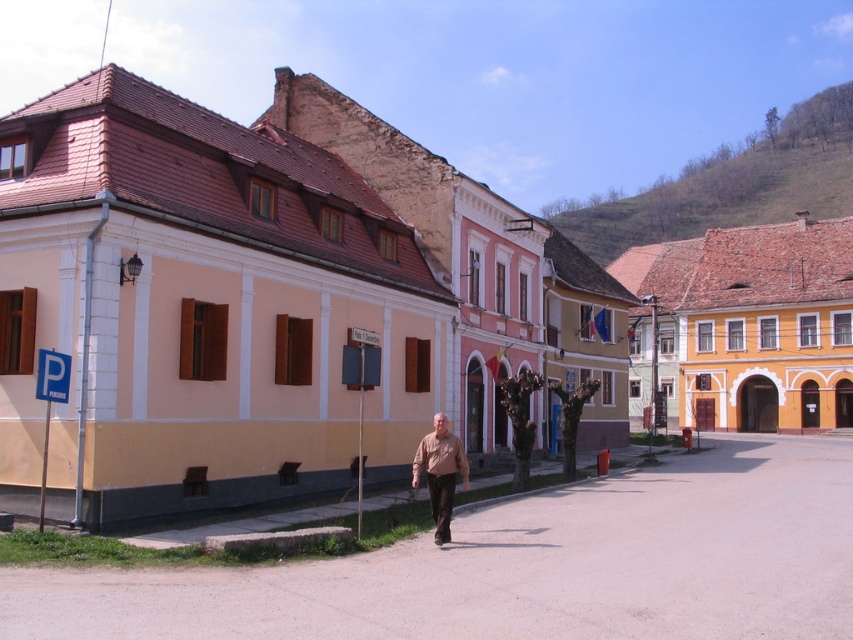
You are a tourist standing on the sidewalk and want to take a photo of both the matte pink building at center and the brown matte shirt at center. Since you want to include both in the frame, will you need to zoom out to capture them together?

The matte pink building at center is wider than the brown matte shirt at center, so you will need to zoom out to ensure both fit in the frame.

You are a tourist standing on the sidewalk and see the matte pink building at center and the brown matte shirt at center. Which one appears larger in size?

The matte pink building at center is bigger than the brown matte shirt at center, so the matte pink building at center appears larger in size.